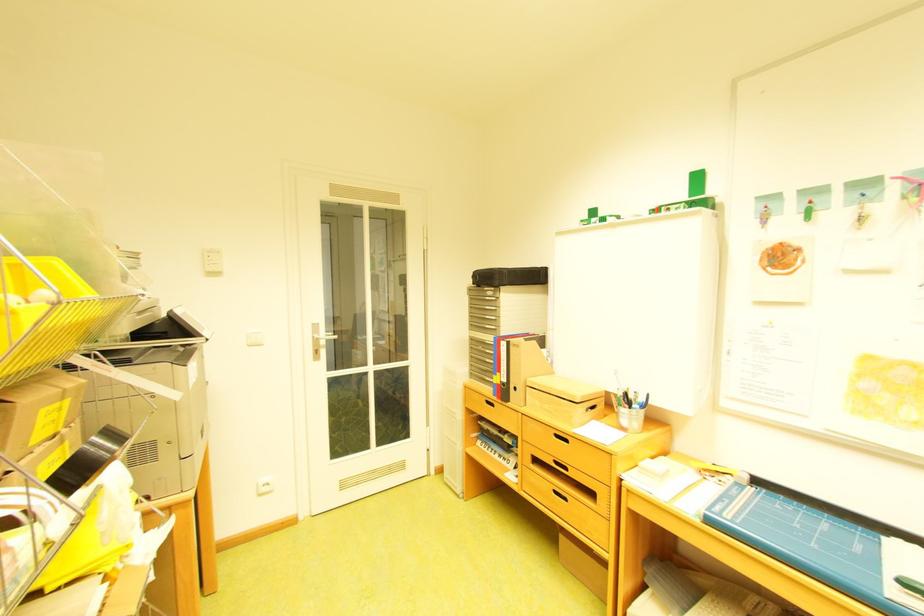
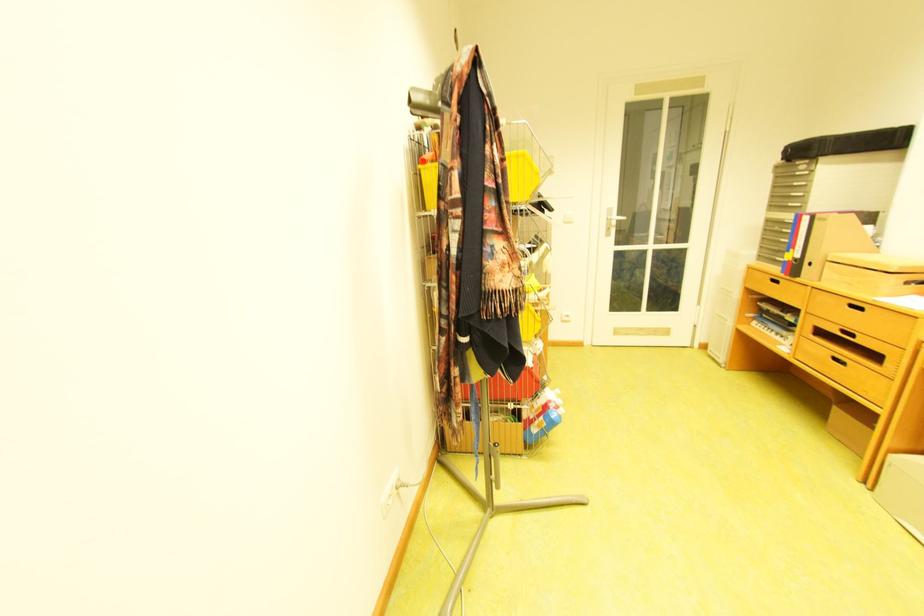
Find the pixel in the second image that matches [567,464] in the first image.

(855, 333)